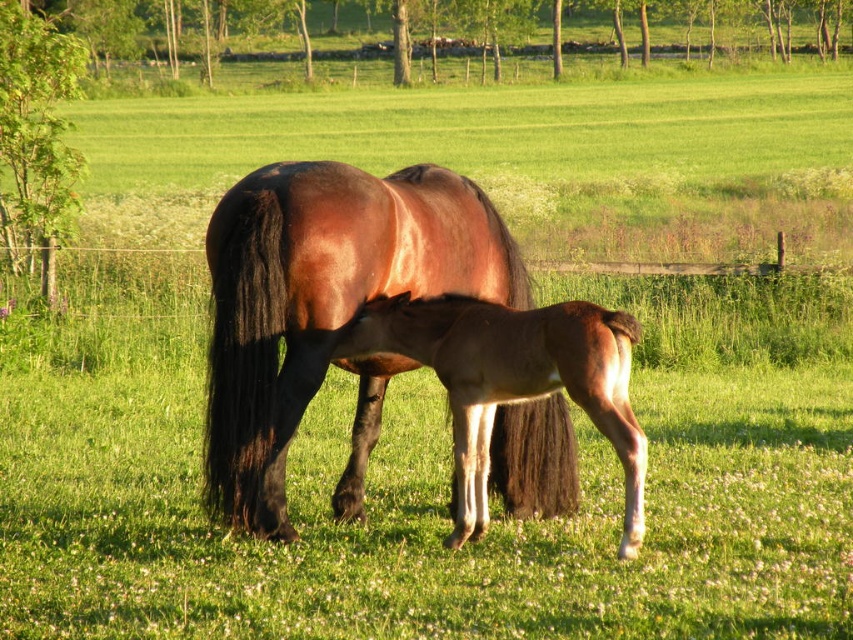
You are a photographer positioned at the origin point. You want to capture a photo of the shiny brown horse at center. What is the exact coordinate where you should aim your camera?

The shiny brown horse at center is located at point (322, 300), so you should aim your camera at those coordinates to capture the horse accurately.

Consider the image. You are a photographer trying to capture a closeup of the shiny brown horse at center and the brown glossy foal at center. From your current position, which horse should you move closer to in order to focus on the one that is farther away?

The shiny brown horse at center is positioned on the left side of the brown glossy foal at center. Since the question asks to focus on the one farther away, you need to determine which is farther. However, the description only mentions their positions relative to each other, not their distances from the observer. Without additional information about their distance from the photographer, it is impossible to determine which is farther away. Therefore, the question cannot be answered with the given information